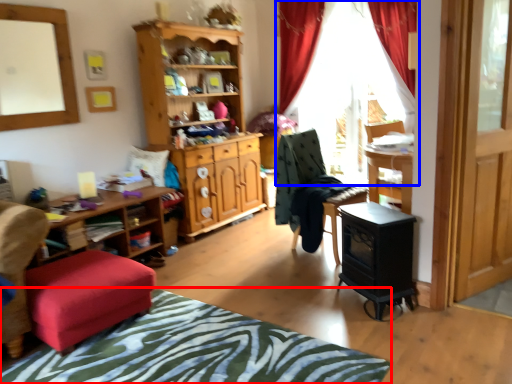
Question: Which object is further to the camera taking this photo, bedcover (highlighted by a red box) or curtain (highlighted by a blue box)?

Choices:
 (A) bedcover
 (B) curtain

Answer: (B)